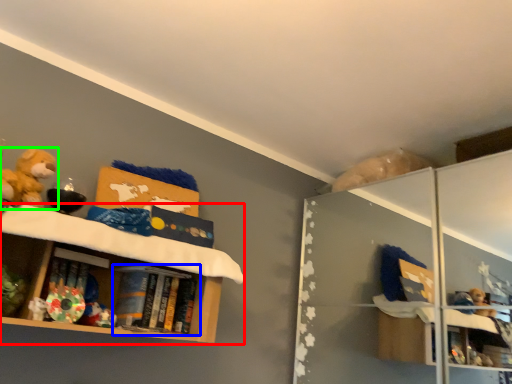
Question: Which object is positioned closest to shelf (highlighted by a red box)? Select from book (highlighted by a blue box) and toy (highlighted by a green box).

Choices:
 (A) book
 (B) toy

Answer: (A)